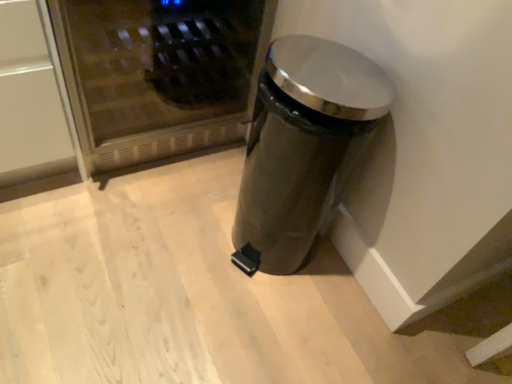
Where is `vacant space situated on the left part of satin silver trash can at lower right`? The image size is (512, 384). vacant space situated on the left part of satin silver trash can at lower right is located at coordinates (183, 230).